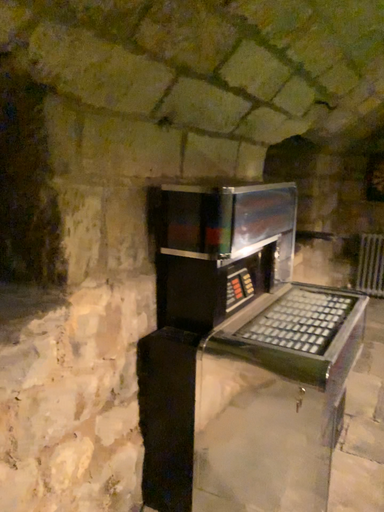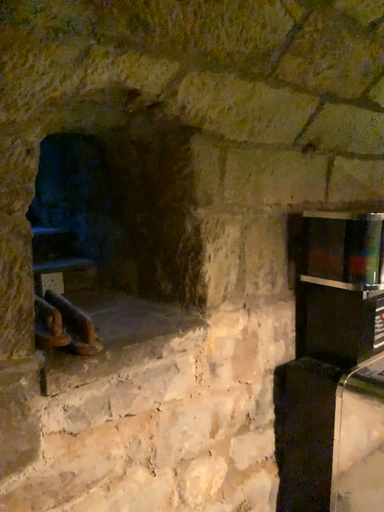
Question: How did the camera likely rotate when shooting the video?

Choices:
 (A) rotated left
 (B) rotated right

Answer: (A)